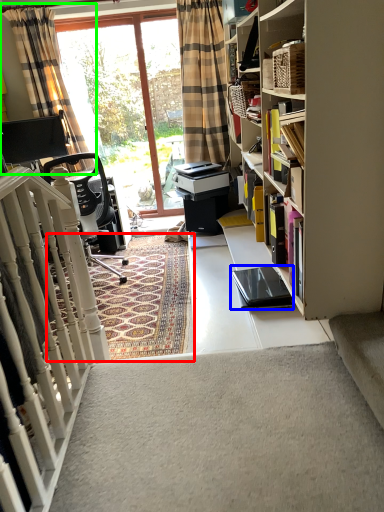
Question: Which object is positioned farthest from mat (highlighted by a red box)? Select from equipment (highlighted by a blue box) and curtain (highlighted by a green box).

Choices:
 (A) equipment
 (B) curtain

Answer: (B)